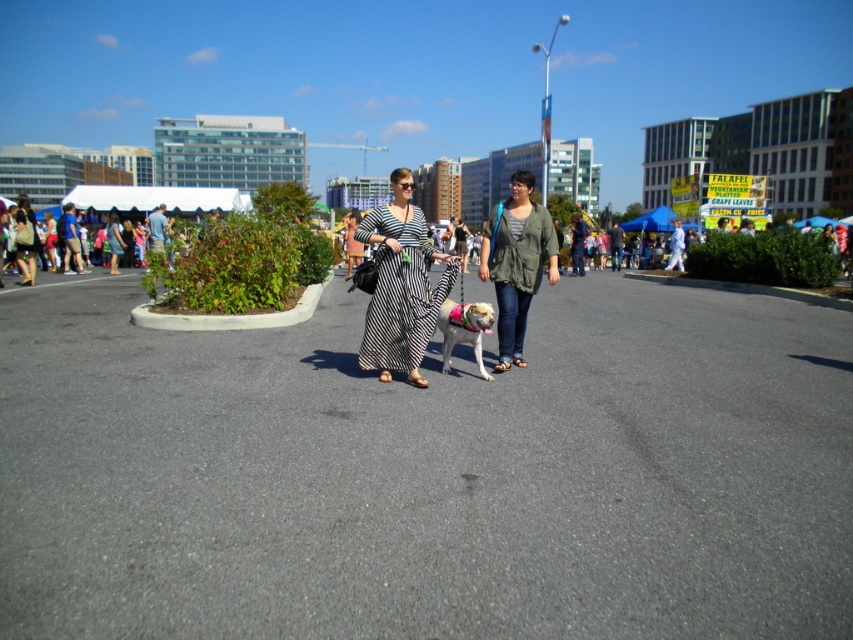
Question: Among these objects, which one is nearest to the camera?

Choices:
 (A) black striped dress at center
 (B) green textured jacket at center

Answer: (A)

Question: Which point appears farthest from the camera in this image?

Choices:
 (A) (492, 253)
 (B) (370, 312)

Answer: (A)

Question: Is black striped dress at center bigger than green textured jacket at center?

Choices:
 (A) no
 (B) yes

Answer: (A)

Question: Which of the following is the farthest from the observer?

Choices:
 (A) (410, 333)
 (B) (509, 346)

Answer: (B)

Question: Can you confirm if black striped dress at center is thinner than green textured jacket at center?

Choices:
 (A) no
 (B) yes

Answer: (B)

Question: Does black striped dress at center appear under green textured jacket at center?

Choices:
 (A) yes
 (B) no

Answer: (A)